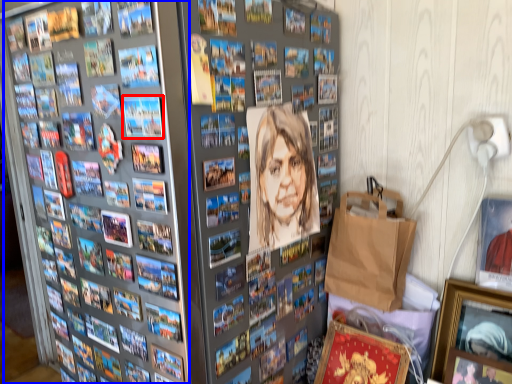
Question: Which object appears closest to the camera in this image, comic book (highlighted by a red box) or comic book (highlighted by a blue box)?

Choices:
 (A) comic book
 (B) comic book

Answer: (B)